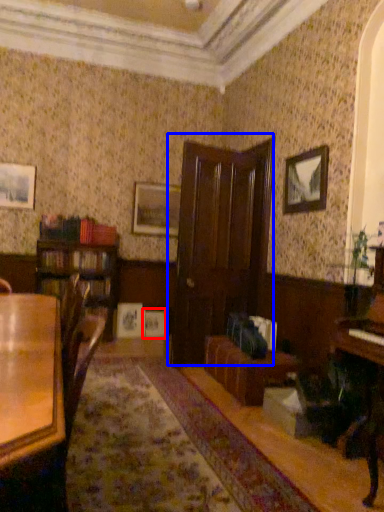
Question: Which object is closer to the camera taking this photo, picture frame (highlighted by a red box) or door (highlighted by a blue box)?

Choices:
 (A) picture frame
 (B) door

Answer: (B)